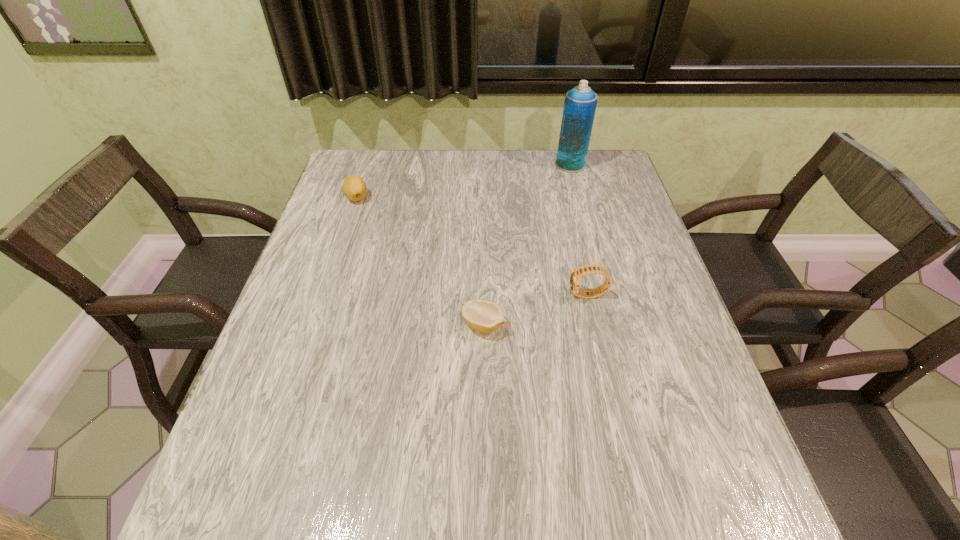
Locate an element on the screen. empty location between the farthest object and the third shortest object is located at coordinates (579, 230).

Image resolution: width=960 pixels, height=540 pixels. Identify the location of unoccupied position between the watch and the tallest object. (579, 230).

This screenshot has width=960, height=540. I want to click on free area in between the shorter lemon and the third nearest object, so click(x=420, y=261).

Where is `free space between the shortest object and the third nearest object`? The width and height of the screenshot is (960, 540). free space between the shortest object and the third nearest object is located at coordinates (420, 261).

Where is `free spot between the second object from left to right and the farthest object`? The width and height of the screenshot is (960, 540). free spot between the second object from left to right and the farthest object is located at coordinates (527, 245).

The height and width of the screenshot is (540, 960). Find the location of `empty space between the farthest object and the second farthest object`. empty space between the farthest object and the second farthest object is located at coordinates (464, 181).

Select which object appears as the second closest to the farthest object. Please provide its 2D coordinates. Your answer should be formatted as a tuple, i.e. [(x, y)], where the tuple contains the x and y coordinates of a point satisfying the conditions above.

[(354, 188)]

Select which object appears as the closest to the taller lemon. Please provide its 2D coordinates. Your answer should be formatted as a tuple, i.e. [(x, y)], where the tuple contains the x and y coordinates of a point satisfying the conditions above.

[(484, 316)]

Locate an element on the screen. free space in the image that satisfies the following two spatial constraints: 1. at the stem end of the third object from right to left; 2. on the right side of the third nearest object is located at coordinates click(x=316, y=325).